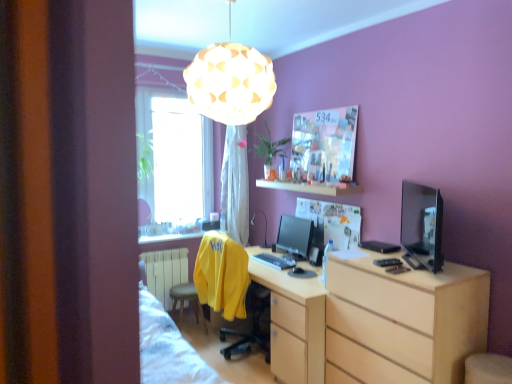
Where is `white textured lampshade at upper center`? This screenshot has width=512, height=384. white textured lampshade at upper center is located at coordinates (230, 82).

Describe the element at coordinates (312, 187) in the screenshot. Image resolution: width=512 pixels, height=384 pixels. I see `white glossy shelf at upper center` at that location.

Identify the location of white plastic keyboard at center. The image size is (512, 384). (274, 261).

From the image's perspective, who appears lower, white textured lampshade at upper center or white sheer curtain at center?

white sheer curtain at center appears lower in the image.

Looking at this image, in terms of height, does white textured lampshade at upper center look taller or shorter compared to white sheer curtain at center?

Considering their sizes, white textured lampshade at upper center has less height than white sheer curtain at center.

Which object is positioned more to the right, white textured lampshade at upper center or white sheer curtain at center?

From the viewer's perspective, white textured lampshade at upper center appears more on the right side.

Locate an element on the screen. The height and width of the screenshot is (384, 512). lamp on the right of white sheer curtain at center is located at coordinates (230, 82).

Is white plastic keyboard at center facing towards white metallic radiator at lower left?

No, white plastic keyboard at center is not turned towards white metallic radiator at lower left.

Is point (277, 264) less distant than point (156, 279)?

That is True.

Considering the positions of objects white plastic keyboard at center and white metallic radiator at lower left in the image provided, who is behind, white plastic keyboard at center or white metallic radiator at lower left?

white metallic radiator at lower left.

In the scene shown: Which is more to the left, white plastic keyboard at center or white metallic radiator at lower left?

white metallic radiator at lower left.

Does yellow fabric stool at lower center have a greater height compared to white sheer curtain at center?

No, yellow fabric stool at lower center is not taller than white sheer curtain at center.

Could you tell me if yellow fabric stool at lower center is turned towards white sheer curtain at center?

No, yellow fabric stool at lower center does not turn towards white sheer curtain at center.

Which is in front, point (179, 297) or point (237, 128)?

The point (179, 297) is closer to the camera.

Between yellow fabric stool at lower center and white sheer curtain at center, which one appears on the right side from the viewer's perspective?

From the viewer's perspective, white sheer curtain at center appears more on the right side.

In the scene shown: Between light wood chest of drawers at lower right and white glossy shelf at upper center, which one has less height?

white glossy shelf at upper center is shorter.

Is light wood chest of drawers at lower right bigger than white glossy shelf at upper center?

Indeed, light wood chest of drawers at lower right has a larger size compared to white glossy shelf at upper center.

Can you tell me how much light wood chest of drawers at lower right and white glossy shelf at upper center differ in facing direction?

0.306 degrees.

Is light wood chest of drawers at lower right to the right of white glossy shelf at upper center from the viewer's perspective?

Correct, you'll find light wood chest of drawers at lower right to the right of white glossy shelf at upper center.

Is there a large distance between yellow fabric swivel chair at center and transparent glass window at upper left?

Absolutely, yellow fabric swivel chair at center is distant from transparent glass window at upper left.

Considering the sizes of objects yellow fabric swivel chair at center and transparent glass window at upper left in the image provided, who is shorter, yellow fabric swivel chair at center or transparent glass window at upper left?

yellow fabric swivel chair at center.

Is yellow fabric swivel chair at center turned away from transparent glass window at upper left?

yellow fabric swivel chair at center does not have its back to transparent glass window at upper left.

From a real-world perspective, is light wood chest of drawers at lower right over satin black monitor at center, which appears as the first computer monitor when viewed from the left?

No.

Is light wood chest of drawers at lower right directly adjacent to satin black monitor at center, which is the 2th computer monitor from right to left?

No, light wood chest of drawers at lower right is not with satin black monitor at center, which is the 2th computer monitor from right to left.

Would you say light wood chest of drawers at lower right is outside satin black monitor at center, the second computer monitor from the front?

Absolutely, light wood chest of drawers at lower right is external to satin black monitor at center, the second computer monitor from the front.

From the image's perspective, is light wood chest of drawers at lower right over satin black monitor at center, which appears as the first computer monitor when viewed from the left?

Actually, light wood chest of drawers at lower right appears below satin black monitor at center, which appears as the first computer monitor when viewed from the left, in the image.

Which object is closer to the camera taking this photo, white glossy shelf at upper center or satin black monitor at center, which appears as the first computer monitor when viewed from the left?

Positioned in front is white glossy shelf at upper center.

From the image's perspective, count 2nd computer monitors downward from the white glossy shelf at upper center and point to it. Please provide its 2D coordinates.

[(295, 236)]

Considering the positions of points (322, 190) and (284, 225), is point (322, 190) closer to camera compared to point (284, 225)?

That is True.

Which object is thinner, white glossy shelf at upper center or satin black monitor at center, which appears as the first computer monitor when viewed from the left?

Thinner between the two is satin black monitor at center, which appears as the first computer monitor when viewed from the left.

Find the location of a particular element. The height and width of the screenshot is (384, 512). curtain behind the white textured lampshade at upper center is located at coordinates (234, 185).

At what (x,y) coordinates should I click in order to perform the action: click on keyboard above the white metallic radiator at lower left (from a real-world perspective). Please return your answer as a coordinate pair (x, y). Looking at the image, I should click on (274, 261).

Estimate the real-world distances between objects in this image. Which object is further from matte black monitor at right, which ranks as the 2th computer monitor in left-to-right order, white plastic keyboard at center or satin black monitor at center, the 1th computer monitor viewed from the back?

white plastic keyboard at center is further to matte black monitor at right, which ranks as the 2th computer monitor in left-to-right order.

From the picture: Which object lies nearer to the anchor point satin black monitor at center, which appears as the first computer monitor when viewed from the left, white glossy shelf at upper center or white textured lampshade at upper center?

white glossy shelf at upper center lies closer to satin black monitor at center, which appears as the first computer monitor when viewed from the left, than the other object.

Considering their positions, is matte black monitor at right, placed as the 1th computer monitor when sorted from right to left, positioned further to yellow fabric swivel chair at center than white sheer curtain at center?

Based on the image, matte black monitor at right, placed as the 1th computer monitor when sorted from right to left, appears to be further to yellow fabric swivel chair at center.

Which object lies further to the anchor point matte black desk lamp at center, white metallic radiator at lower left or white sheer curtain at center?

white metallic radiator at lower left is positioned further to the anchor matte black desk lamp at center.

In the scene shown: From the image, which object appears to be farther from yellow fabric swivel chair at center, transparent glass window at upper left or satin black monitor at center, the 1th computer monitor viewed from the back?

transparent glass window at upper left is positioned further to the anchor yellow fabric swivel chair at center.

Estimate the real-world distances between objects in this image. Which object is closer to matte black monitor at right, placed as the 1th computer monitor when sorted from right to left, white glossy shelf at upper center or satin black monitor at center, which appears as the first computer monitor when viewed from the left?

Among the two, white glossy shelf at upper center is located nearer to matte black monitor at right, placed as the 1th computer monitor when sorted from right to left.

Looking at the image, which one is located closer to white sheer curtain at center, light wood chest of drawers at lower right or white glossy shelf at upper center?

white glossy shelf at upper center.

Estimate the real-world distances between objects in this image. Which object is further from white plastic keyboard at center, satin black monitor at center, the 1th computer monitor viewed from the back, or white textured lampshade at upper center?

Based on the image, white textured lampshade at upper center appears to be further to white plastic keyboard at center.

Where is `stool situated between white metallic radiator at lower left and white plastic keyboard at center from left to right`? The width and height of the screenshot is (512, 384). stool situated between white metallic radiator at lower left and white plastic keyboard at center from left to right is located at coordinates (188, 300).

Where is `table lamp between light wood chest of drawers at lower right and white sheer curtain at center from front to back`? table lamp between light wood chest of drawers at lower right and white sheer curtain at center from front to back is located at coordinates (265, 224).

Locate an element on the screen. swivel chair between light wood chest of drawers at lower right and matte black desk lamp at center along the z-axis is located at coordinates (230, 288).

What are the coordinates of `computer monitor located between matte black monitor at right, placed as the 1th computer monitor when sorted from right to left, and yellow fabric stool at lower center in the depth direction` in the screenshot? It's located at (295, 236).